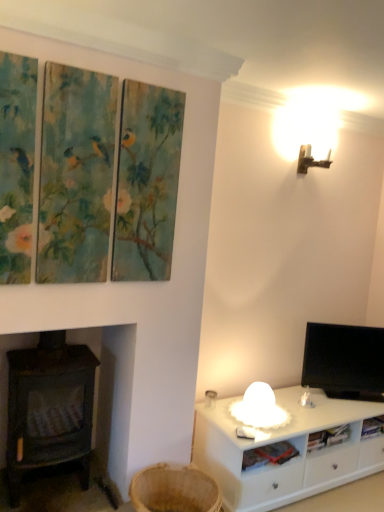
Question: Considering the positions of dark brown wood burning stove at left and black glossy tv at right in the image, is dark brown wood burning stove at left taller or shorter than black glossy tv at right?

Choices:
 (A) short
 (B) tall

Answer: (B)

Question: From a real-world perspective, is dark brown wood burning stove at left above or below black glossy tv at right?

Choices:
 (A) above
 (B) below

Answer: (B)

Question: Estimate the real-world distances between objects in this image. Which object is farther from the white fabric table lamp at lower right?

Choices:
 (A) woven brown basket at lower left
 (B) white plastic shelf at lower right
 (C) metallic wall sconce at upper right
 (D) dark brown wood burning stove at left
 (E) black glossy tv at right

Answer: (C)

Question: Which is farther from the dark brown wood burning stove at left?

Choices:
 (A) white plastic shelf at lower right
 (B) woven brown basket at lower left
 (C) metallic wall sconce at upper right
 (D) black glossy tv at right
 (E) white fabric table lamp at lower right

Answer: (C)